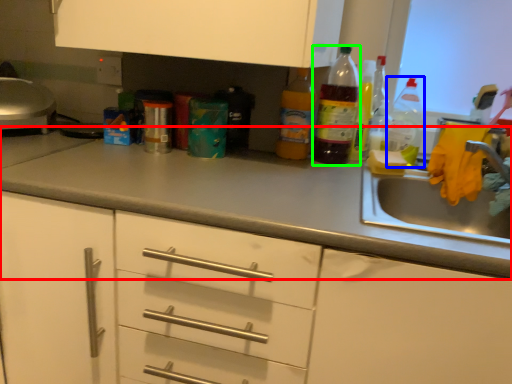
Question: Considering the real-world distances, which object is farthest from countertop (highlighted by a red box)? bottle (highlighted by a blue box) or bottle (highlighted by a green box)?

Choices:
 (A) bottle
 (B) bottle

Answer: (A)